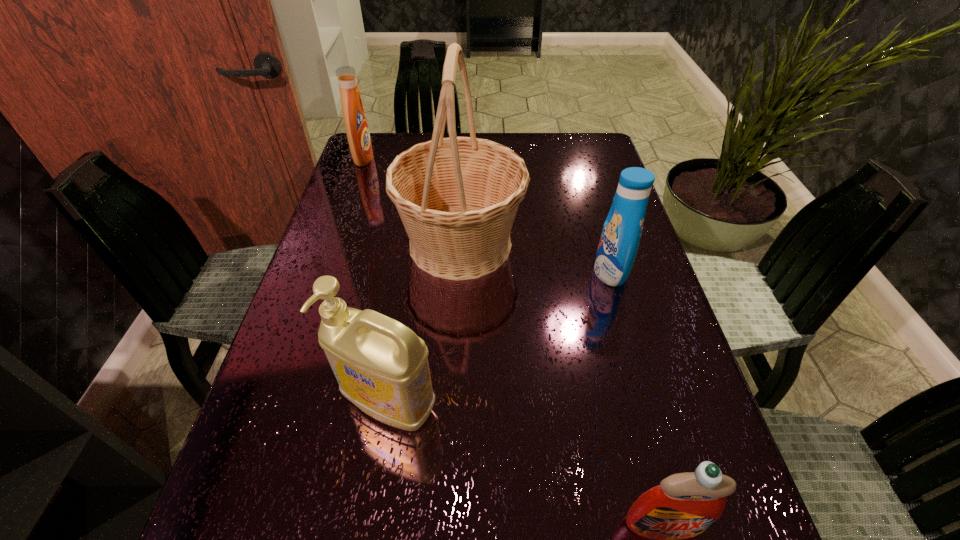
Locate an element on the screen. The width and height of the screenshot is (960, 540). vacant space located on the front-facing side of the second farthest detergent is located at coordinates (521, 272).

This screenshot has height=540, width=960. What are the coordinates of `free space located on the front-facing side of the second farthest detergent` in the screenshot? It's located at (465, 272).

This screenshot has height=540, width=960. What are the coordinates of `object that is at the far edge` in the screenshot? It's located at (355, 120).

I want to click on object situated at the right edge, so click(622, 230).

The image size is (960, 540). Identify the location of object located in the far left corner section of the desktop. (355, 120).

At what (x,y) coordinates should I click in order to perform the action: click on vacant position at the far edge of the desktop. Please return your answer as a coordinate pair (x, y). Looking at the image, I should click on (532, 133).

In order to click on free space at the left edge of the desktop in this screenshot , I will do `click(318, 457)`.

This screenshot has height=540, width=960. I want to click on vacant area at the right edge of the desktop, so click(x=717, y=525).

Where is `free space between the third nearest detergent and the basket`? free space between the third nearest detergent and the basket is located at coordinates (536, 258).

This screenshot has height=540, width=960. I want to click on vacant region between the third detergent from right to left and the tallest object, so click(425, 324).